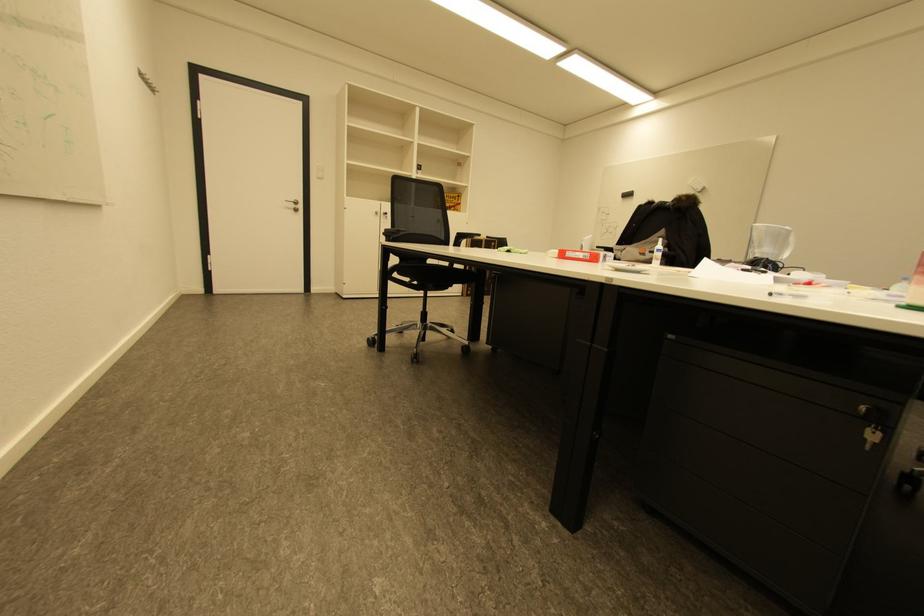
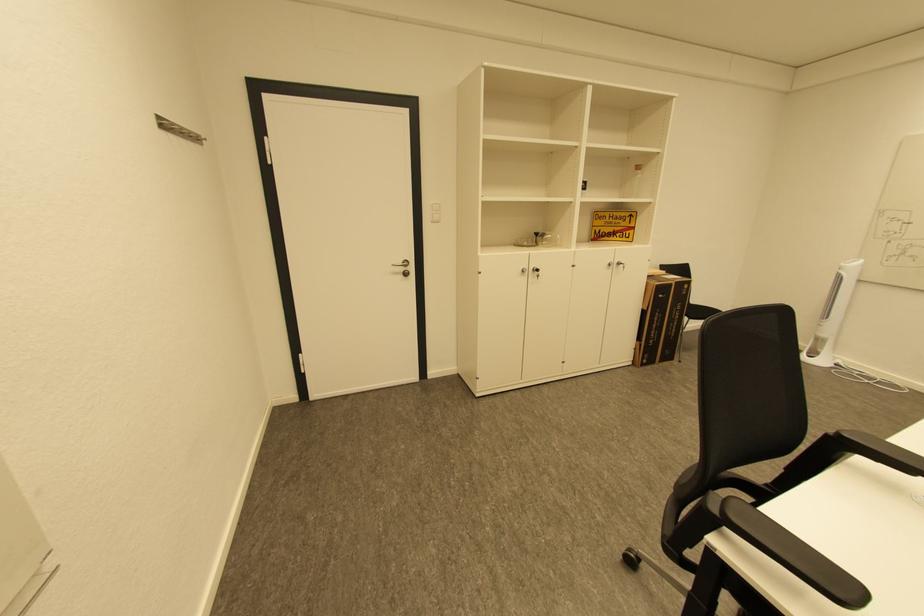
In the second image, find the point that corresponds to [299,207] in the first image.

(408, 270)